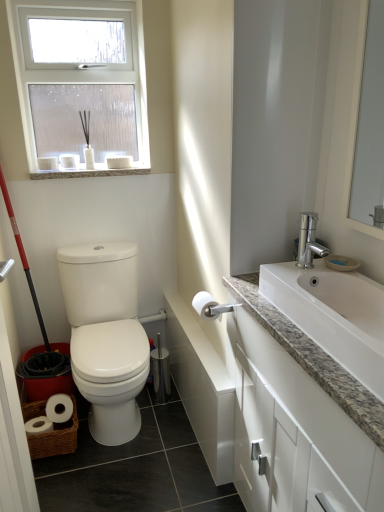
Question: From a real-world perspective, is white glossy toilet paper at center above or below white glossy toilet at left?

Choices:
 (A) below
 (B) above

Answer: (B)

Question: In terms of height, does white glossy toilet paper at center look taller or shorter compared to white glossy toilet at left?

Choices:
 (A) short
 (B) tall

Answer: (A)

Question: Estimate the real-world distances between objects in this image. Which object is closer to the white glossy toilet at left?

Choices:
 (A) white glossy toilet paper at center
 (B) white granite sink at right
 (C) granite at upper left
 (D) woven brown basket at lower left
 (E) white matte toilet paper at upper right

Answer: (A)

Question: Which of these objects is positioned closest to the woven brown basket at lower left?

Choices:
 (A) white glossy mirror at upper right
 (B) white granite countertop at right
 (C) red plastic screen door at left
 (D) white frosted glass window at upper left
 (E) white matte toilet paper at upper right

Answer: (C)